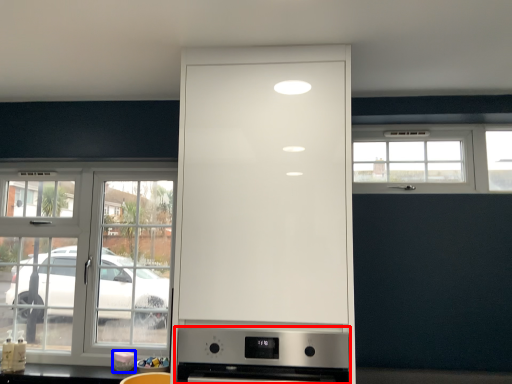
Question: Which object is closer to the camera taking this photo, home appliance (highlighted by a red box) or appliance (highlighted by a blue box)?

Choices:
 (A) home appliance
 (B) appliance

Answer: (A)